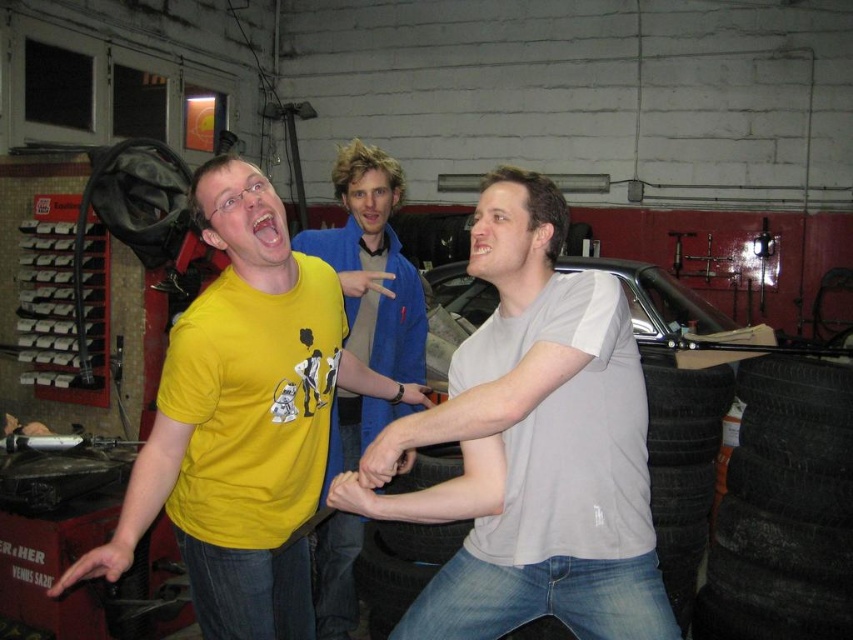
Is yellow matte t-shirt at left below black rubber tire at lower center?

No, yellow matte t-shirt at left is not below black rubber tire at lower center.

Between point (187, 480) and point (445, 536), which one is positioned behind?

The point (445, 536) is more distant.

Where is `yellow matte t-shirt at left`? The height and width of the screenshot is (640, 853). yellow matte t-shirt at left is located at coordinates (242, 419).

Who is taller, gray matte t-shirt at center or yellow t-shirt at left?

With more height is yellow t-shirt at left.

Looking at this image, measure the distance from gray matte t-shirt at center to yellow t-shirt at left.

gray matte t-shirt at center is 30.59 inches from yellow t-shirt at left.

The image size is (853, 640). Find the location of `gray matte t-shirt at center`. gray matte t-shirt at center is located at coordinates (532, 445).

What are the coordinates of `gray matte t-shirt at center` in the screenshot? It's located at (532, 445).

Does gray matte t-shirt at center have a larger size compared to yellow matte t-shirt at left?

No, gray matte t-shirt at center is not bigger than yellow matte t-shirt at left.

Does point (366, 515) come in front of point (212, 173)?

No, it is behind (212, 173).

Image resolution: width=853 pixels, height=640 pixels. I want to click on gray matte t-shirt at center, so click(532, 445).